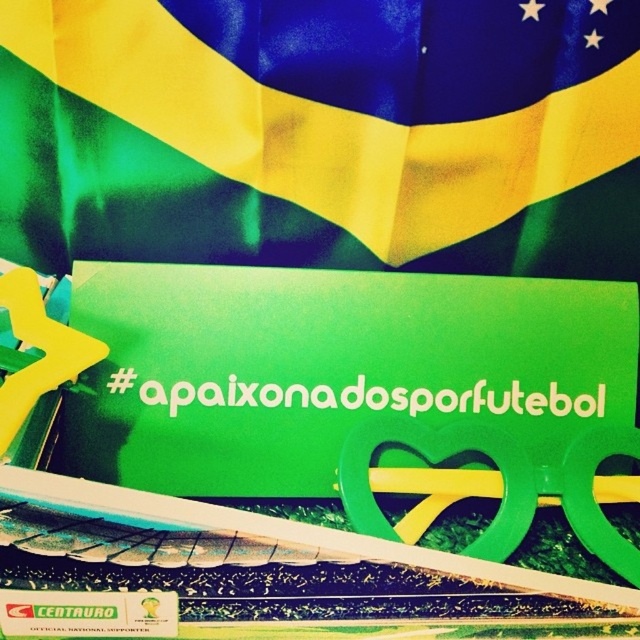
Can you confirm if green fabric flag at upper center is smaller than green matte sign at center?

No.

Is green fabric flag at upper center bigger than green matte sign at center?

Yes, green fabric flag at upper center is bigger than green matte sign at center.

Find the location of a particular element. green fabric flag at upper center is located at coordinates (323, 132).

Identify the location of green fabric flag at upper center. This screenshot has width=640, height=640. (323, 132).